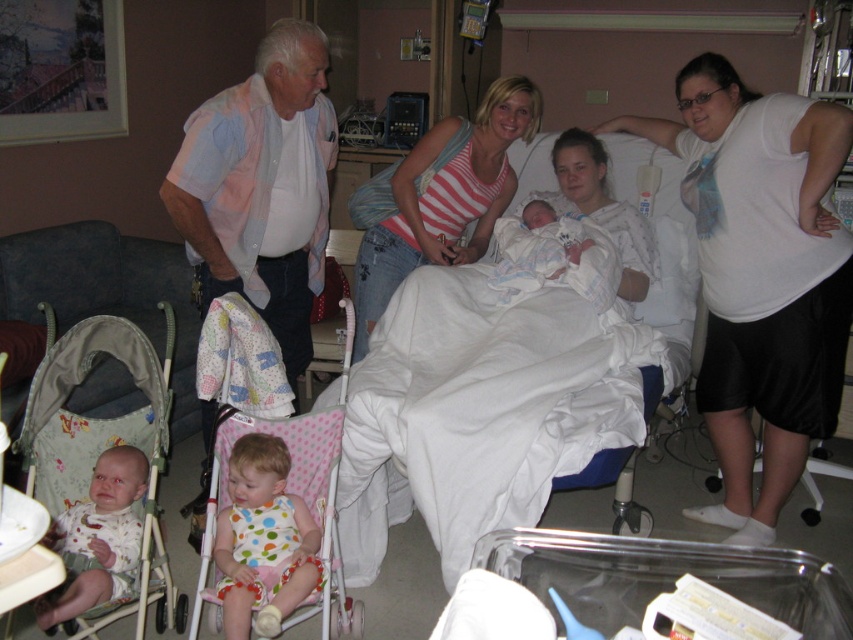
Is white fabric hospital bed at center wider than white matte shirt at upper right?

→ Yes, white fabric hospital bed at center is wider than white matte shirt at upper right.

Measure the distance between point [473,492] and camera.

A distance of 7.04 feet exists between point [473,492] and camera.

Does point (460, 477) come farther from viewer compared to point (711, 278)?

No, it is not.

Locate an element on the screen. The width and height of the screenshot is (853, 640). white fabric hospital bed at center is located at coordinates (509, 380).

Is point (518, 476) less distant than point (424, 237)?

Yes, it is.

Does white fabric hospital bed at center appear under striped tank top at center?

Yes, white fabric hospital bed at center is below striped tank top at center.

I want to click on white fabric hospital bed at center, so click(x=509, y=380).

Is the position of pink cotton shirt at left less distant than that of polka dot fabric baby at center?

No, pink cotton shirt at left is further to the viewer.

Image resolution: width=853 pixels, height=640 pixels. What do you see at coordinates (260, 188) in the screenshot? I see `pink cotton shirt at left` at bounding box center [260, 188].

Where is `pink cotton shirt at left`? pink cotton shirt at left is located at coordinates (260, 188).